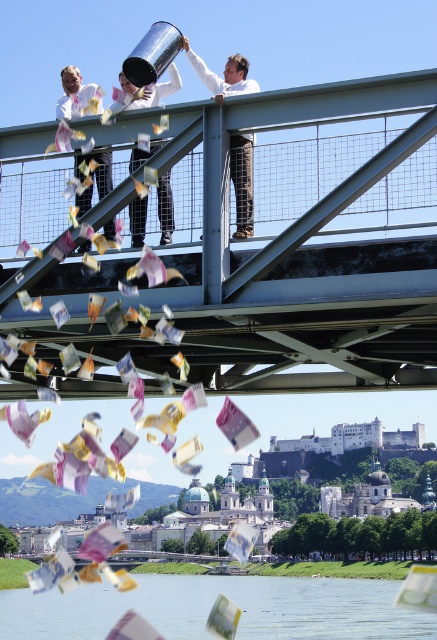
Does metallic steel bridge at upper center have a smaller size compared to white cotton shirt at center?

Incorrect, metallic steel bridge at upper center is not smaller in size than white cotton shirt at center.

Image resolution: width=437 pixels, height=640 pixels. What are the coordinates of `metallic steel bridge at upper center` in the screenshot? It's located at (298, 252).

Between point (398, 378) and point (101, 196), which one is positioned in front?

Point (101, 196) is more forward.

Can you confirm if metallic steel bridge at upper center is positioned above matte white shirt at left?

No, metallic steel bridge at upper center is not above matte white shirt at left.

You are a GUI agent. You are given a task and a screenshot of the screen. Output one action in this format:
    pyautogui.click(x=<x>, y=<y>)
    Task: Click on the metallic steel bridge at upper center
    The width and height of the screenshot is (437, 640).
    Given the screenshot: What is the action you would take?
    pyautogui.click(x=298, y=252)

Locate an element on the screen. Image resolution: width=437 pixels, height=640 pixels. metallic steel bridge at upper center is located at coordinates click(x=298, y=252).

Consider the image. Who is positioned more to the right, white cotton shirt at center or matte white shirt at left?

white cotton shirt at center is more to the right.

Is white cotton shirt at center closer to the viewer compared to matte white shirt at left?

Yes, it is in front of matte white shirt at left.

Is point (159, 208) closer to viewer compared to point (70, 67)?

That is True.

Locate an element on the screen. white cotton shirt at center is located at coordinates (165, 209).